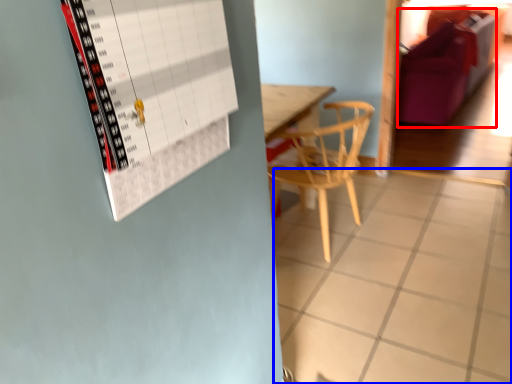
Question: Which object is further to the camera taking this photo, couch (highlighted by a red box) or tile (highlighted by a blue box)?

Choices:
 (A) couch
 (B) tile

Answer: (A)